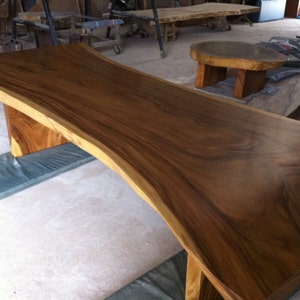
Where is `tabletops`? tabletops is located at coordinates (179, 13), (236, 46), (214, 128).